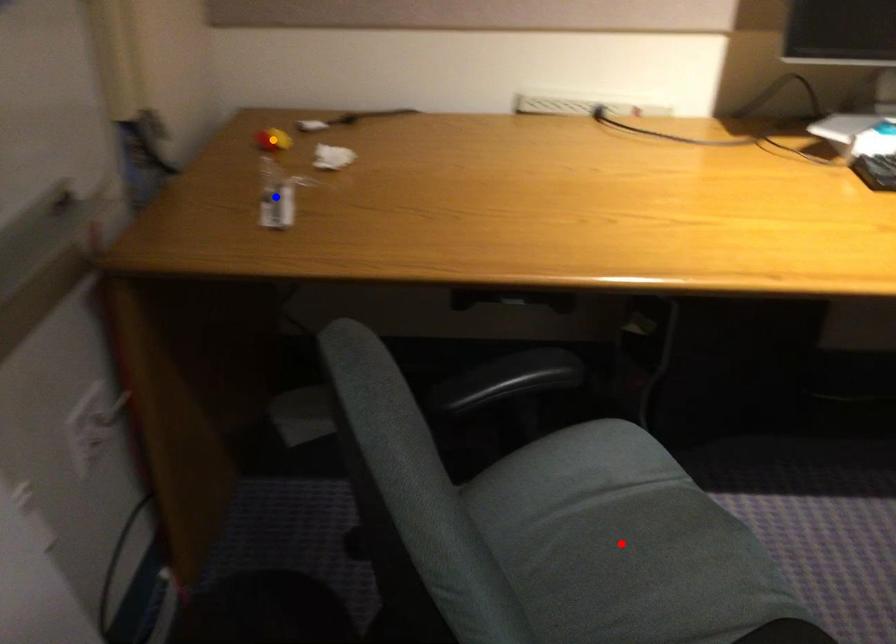
Order these from nearest to farthest:
- red point
- blue point
- orange point

red point → blue point → orange point